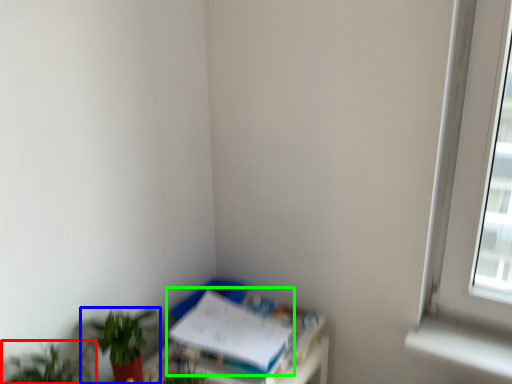
Question: Considering the real-world distances, which object is farthest from houseplant (highlighted by a red box)? houseplant (highlighted by a blue box) or paperback book (highlighted by a green box)?

Choices:
 (A) houseplant
 (B) paperback book

Answer: (B)